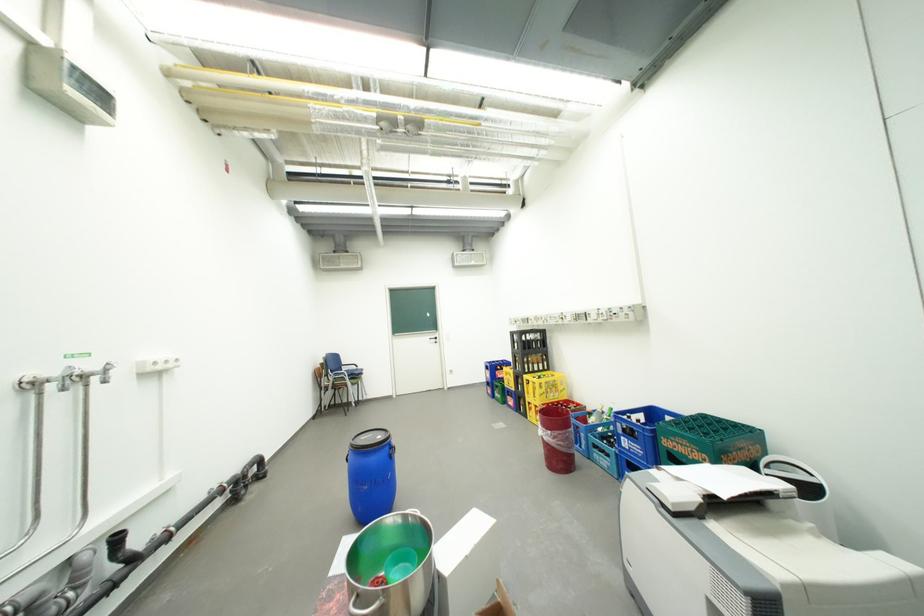
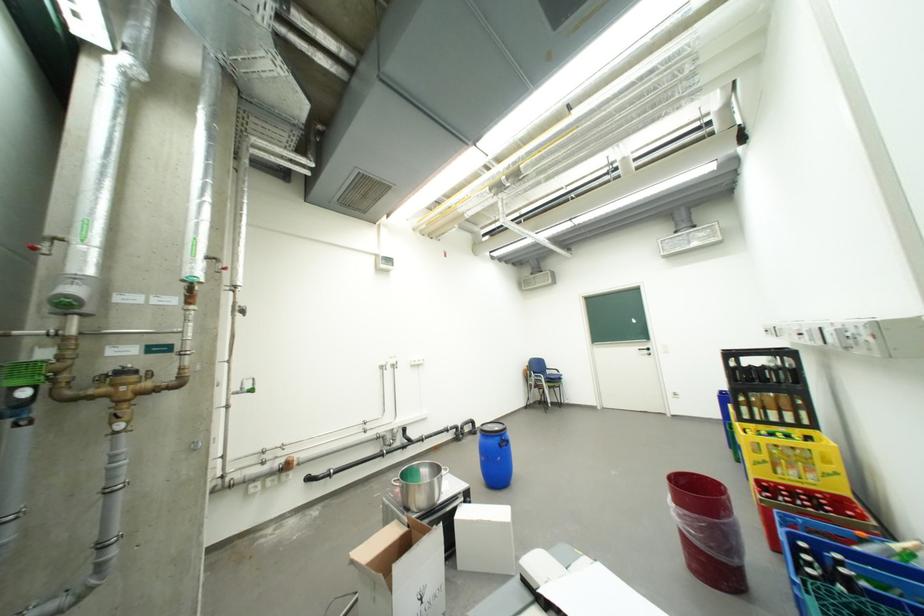
Find the pixel in the second image that matches point 396,447 in the first image.

(507, 438)